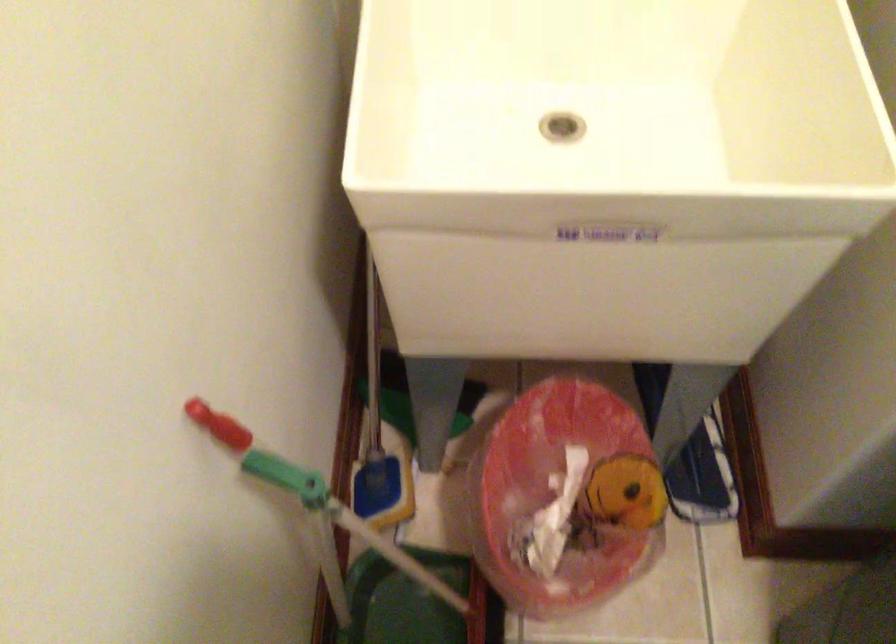
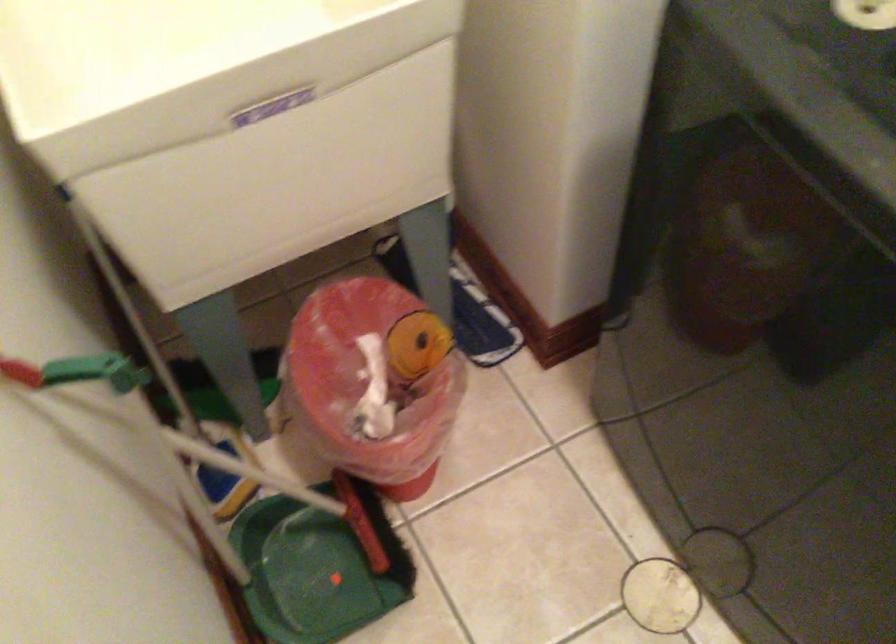
Question: The camera is either moving clockwise (left) or counter-clockwise (right) around the object. The first image is from the beginning of the video and the second image is from the end. Is the camera moving left or right when shooting the video?

Choices:
 (A) Left
 (B) Right

Answer: (A)